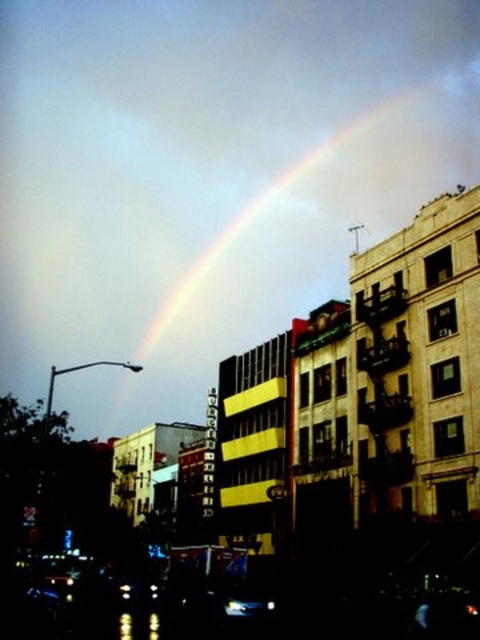
Who is more forward, [387,129] or [254,609]?

Point [254,609] is more forward.

Where is `rainbow at upper center`? rainbow at upper center is located at coordinates (285, 250).